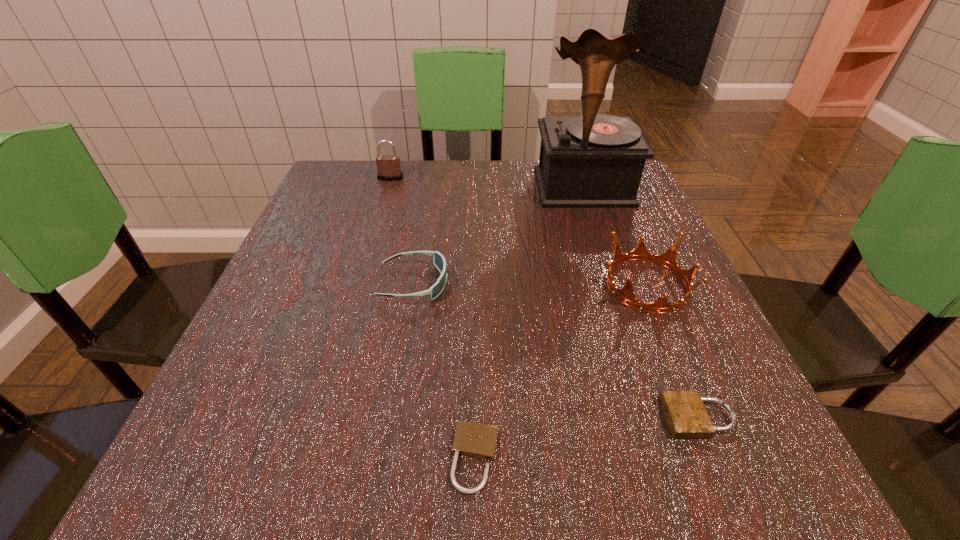
Identify the location of object present at the left edge. (388, 166).

This screenshot has height=540, width=960. I want to click on phonograph_record situated at the right edge, so click(x=594, y=160).

Locate an element on the screen. The image size is (960, 540). crown at the right edge is located at coordinates (626, 295).

Where is `padlock located at the right edge`? padlock located at the right edge is located at coordinates [x=686, y=415].

Image resolution: width=960 pixels, height=540 pixels. I want to click on object that is at the far left corner, so click(x=388, y=166).

At what (x,y) coordinates should I click in order to perform the action: click on object present at the far right corner. Please return your answer as a coordinate pair (x, y). The width and height of the screenshot is (960, 540). Looking at the image, I should click on tap(594, 160).

The width and height of the screenshot is (960, 540). In order to click on object located at the near right corner in this screenshot , I will do `click(686, 415)`.

Where is `vacant space at the far edge of the desktop`? vacant space at the far edge of the desktop is located at coordinates (423, 202).

Identify the location of free space at the near edge of the desktop. The width and height of the screenshot is (960, 540). (479, 484).

Identify the location of free spot at the left edge of the desktop. (330, 336).